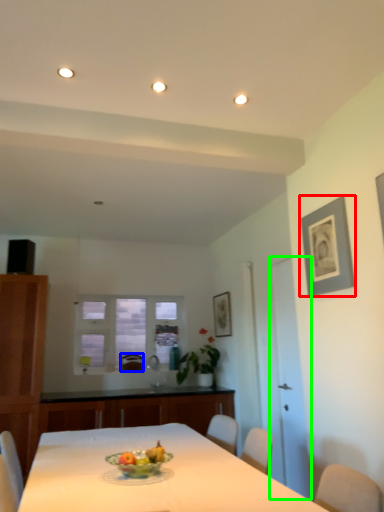
Question: Which is farther away from picture frame (highlighted by a red box)? armchair (highlighted by a blue box) or glass door (highlighted by a green box)?

Choices:
 (A) armchair
 (B) glass door

Answer: (A)